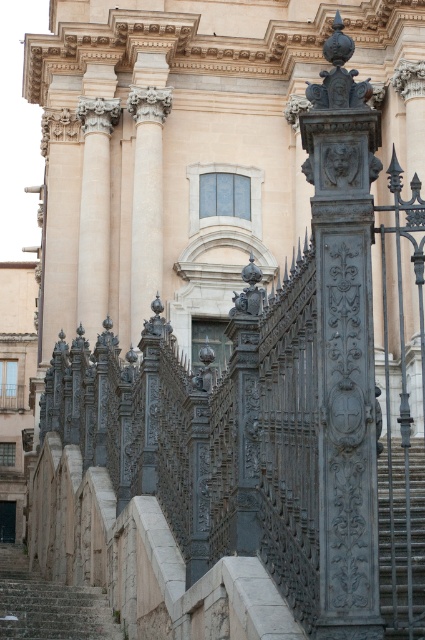
Does gray metallic column at right lie in front of dark gray stone stairs at lower right?

No, it is behind dark gray stone stairs at lower right.

Looking at this image, does gray metallic column at right have a smaller size compared to dark gray stone stairs at lower right?

Indeed, gray metallic column at right has a smaller size compared to dark gray stone stairs at lower right.

Between point (360, 465) and point (390, 589), which one is positioned in front?

Point (360, 465) is in front.

I want to click on gray metallic column at right, so click(x=343, y=342).

Who is positioned more to the left, dark gray stone stairs at lower right or stone stairs at lower left?

From the viewer's perspective, stone stairs at lower left appears more on the left side.

In the scene shown: Does dark gray stone stairs at lower right appear under stone stairs at lower left?

Actually, dark gray stone stairs at lower right is above stone stairs at lower left.

Which is behind, point (416, 444) or point (96, 618)?

Point (416, 444)

I want to click on dark gray stone stairs at lower right, so click(402, 536).

Is point (367, 308) more distant than point (48, 588)?

No, it is not.

Can you confirm if gray metallic column at right is smaller than stone stairs at lower left?

Yes, gray metallic column at right is smaller than stone stairs at lower left.

Where is `gray metallic column at right`? gray metallic column at right is located at coordinates (343, 342).